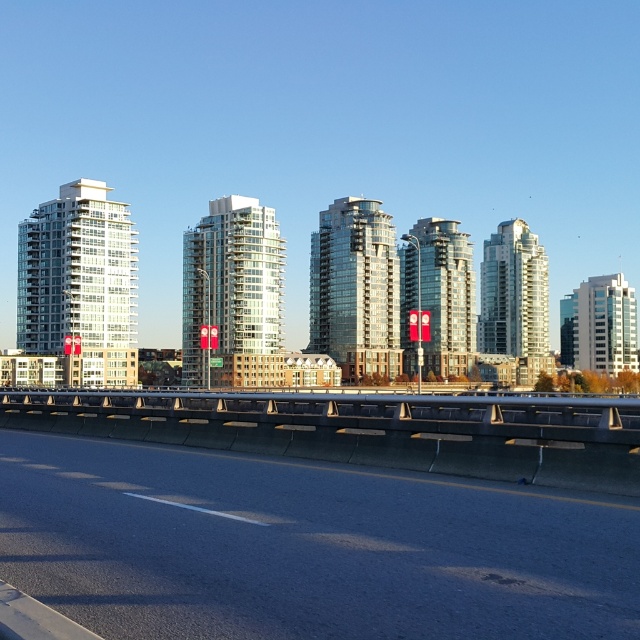
Is white glass building at left bigger than glassy reflective building at center?

Actually, white glass building at left might be smaller than glassy reflective building at center.

Is white glass building at left shorter than glassy reflective building at center?

No, white glass building at left is not shorter than glassy reflective building at center.

Is point (70, 248) closer to viewer compared to point (452, 332)?

Yes, point (70, 248) is closer to viewer.

What are the coordinates of `white glass building at left` in the screenshot? It's located at (80, 284).

Who is taller, white glass building at left or glossy glass building at center?

With more height is glossy glass building at center.

Is point (88, 276) in front of point (360, 298)?

Yes, point (88, 276) is closer to viewer.

Find the location of a particular element. The image size is (640, 640). white glass building at left is located at coordinates (80, 284).

Which is behind, point (492, 592) or point (484, 324)?

The point (484, 324) is more distant.

Is point (532, 499) behind point (504, 244)?

No, (532, 499) is closer to viewer.

Where is `black asphalt highway at lower center`? black asphalt highway at lower center is located at coordinates (305, 547).